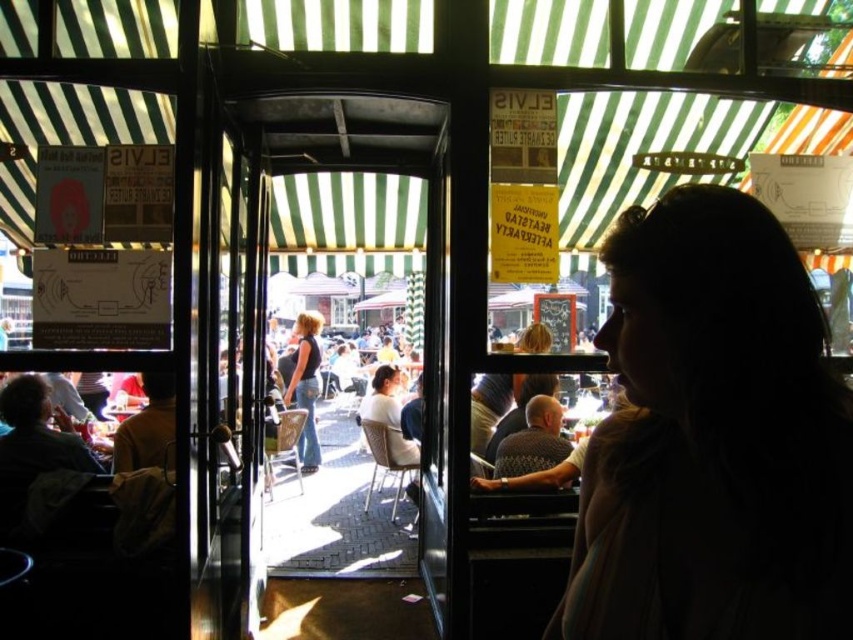
Question: Which is nearer to the transparent glass door at center?

Choices:
 (A) denim jeans at center
 (B) silhouette hair at right

Answer: (B)

Question: Is silhouette hair at right above denim jeans at center?

Choices:
 (A) no
 (B) yes

Answer: (B)

Question: Which object is closer to the camera taking this photo?

Choices:
 (A) denim jeans at center
 (B) transparent glass door at center

Answer: (B)

Question: Does transparent glass door at center come in front of denim jeans at center?

Choices:
 (A) yes
 (B) no

Answer: (A)

Question: Which point is closer to the camera taking this photo?

Choices:
 (A) (287, 392)
 (B) (341, 152)
 (C) (639, 548)

Answer: (C)

Question: Does silhouette hair at right lie behind denim jeans at center?

Choices:
 (A) no
 (B) yes

Answer: (A)